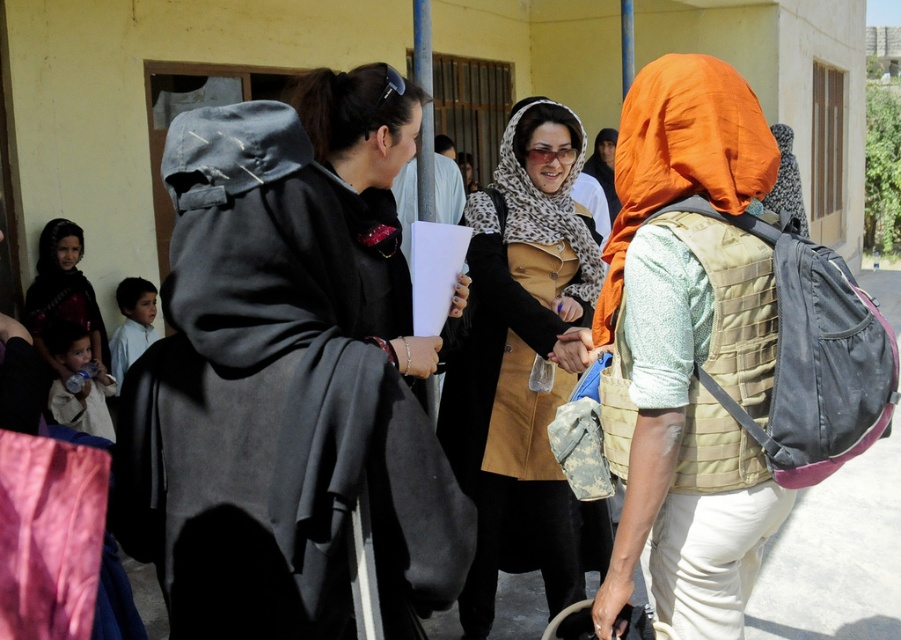
Which of these two, leopard print fabric at center or matte black dress at lower left, stands taller?

With more height is leopard print fabric at center.

Can you confirm if leopard print fabric at center is taller than matte black dress at lower left?

Yes, leopard print fabric at center is taller than matte black dress at lower left.

What do you see at coordinates (522, 364) in the screenshot? This screenshot has width=901, height=640. I see `leopard print fabric at center` at bounding box center [522, 364].

Identify the location of leopard print fabric at center. (522, 364).

Between point (645, 113) and point (43, 314), which one is positioned in front?

Point (645, 113) is in front.

Consider the image. Is orange fabric headscarf at center below matte black dress at lower left?

Yes.

Is point (719, 433) closer to camera compared to point (92, 307)?

Yes, it is in front of point (92, 307).

Locate an element on the screen. orange fabric headscarf at center is located at coordinates (688, 348).

Is the position of dark gray woolen robe at center more distant than that of leopard print fabric at center?

No, dark gray woolen robe at center is closer to the viewer.

The image size is (901, 640). What do you see at coordinates (279, 401) in the screenshot?
I see `dark gray woolen robe at center` at bounding box center [279, 401].

Find the location of a particular element. Image resolution: width=901 pixels, height=640 pixels. dark gray woolen robe at center is located at coordinates (279, 401).